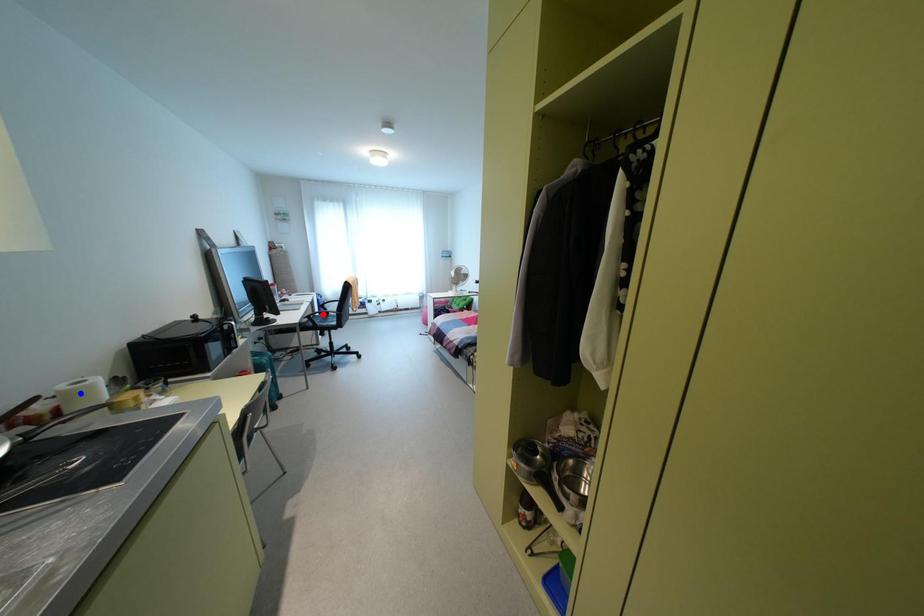
Question: Which of the two points in the image is closer to the camera?

Choices:
 (A) Blue point is closer.
 (B) Red point is closer.

Answer: (A)